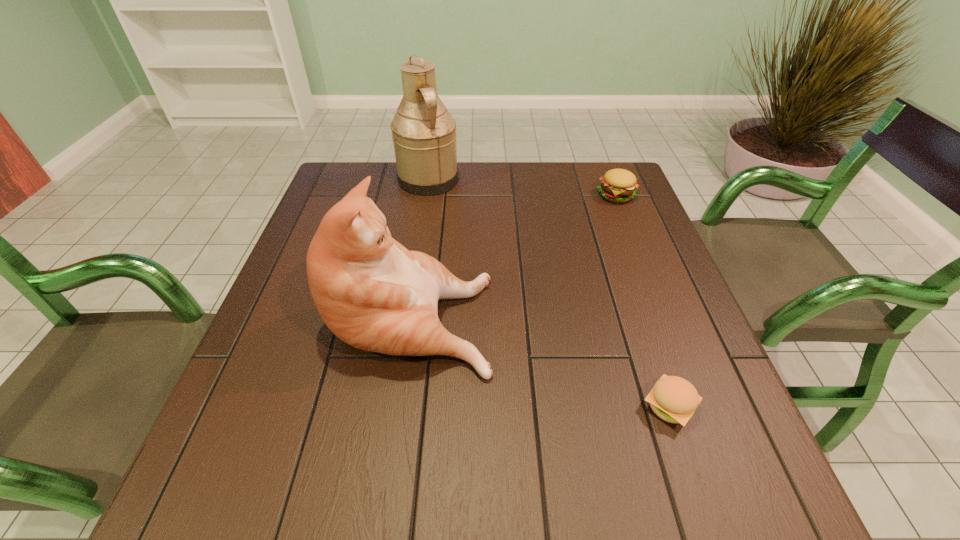
Find the location of a particular element. The width and height of the screenshot is (960, 540). empty space that is in between the shortest object and the farther hamburger is located at coordinates (643, 301).

Locate an element on the screen. This screenshot has height=540, width=960. unoccupied position between the pitcher and the farther hamburger is located at coordinates (522, 187).

At what (x,y) coordinates should I click in order to perform the action: click on free space between the cat and the farther hamburger. Please return your answer as a coordinate pair (x, y). This screenshot has width=960, height=540. Looking at the image, I should click on (514, 254).

Locate an element on the screen. This screenshot has height=540, width=960. vacant area that lies between the farther hamburger and the cat is located at coordinates (514, 254).

Identify the location of vacant space in between the shortest object and the farther hamburger. This screenshot has width=960, height=540. (643, 301).

Identify the location of free space between the cat and the pitcher. (420, 247).

This screenshot has height=540, width=960. Find the location of `vacant region between the nearer hamburger and the farther hamburger`. vacant region between the nearer hamburger and the farther hamburger is located at coordinates (643, 301).

At what (x,y) coordinates should I click in order to perform the action: click on free space between the cat and the pitcher. Please return your answer as a coordinate pair (x, y). Looking at the image, I should click on (420, 247).

You are a GUI agent. You are given a task and a screenshot of the screen. Output one action in this format:
    pyautogui.click(x=<x>, y=<y>)
    Task: Click on the free spot between the pitcher and the shorter hamburger
    The image size is (960, 540).
    Given the screenshot: What is the action you would take?
    pyautogui.click(x=549, y=293)

Image resolution: width=960 pixels, height=540 pixels. What are the coordinates of `object that is the second closest to the shorter hamburger` in the screenshot? It's located at (617, 185).